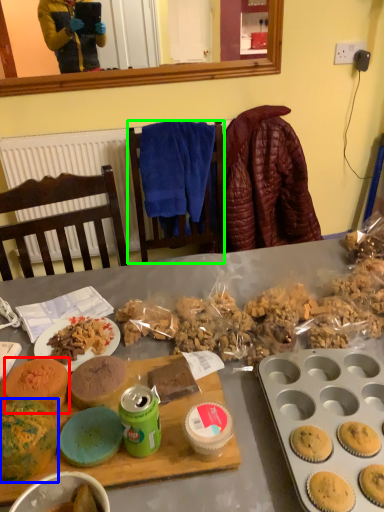
Question: Which object is the closest to the snack (highlighted by a red box)? Choose among these: snack (highlighted by a blue box) or chair (highlighted by a green box).

Choices:
 (A) snack
 (B) chair

Answer: (A)